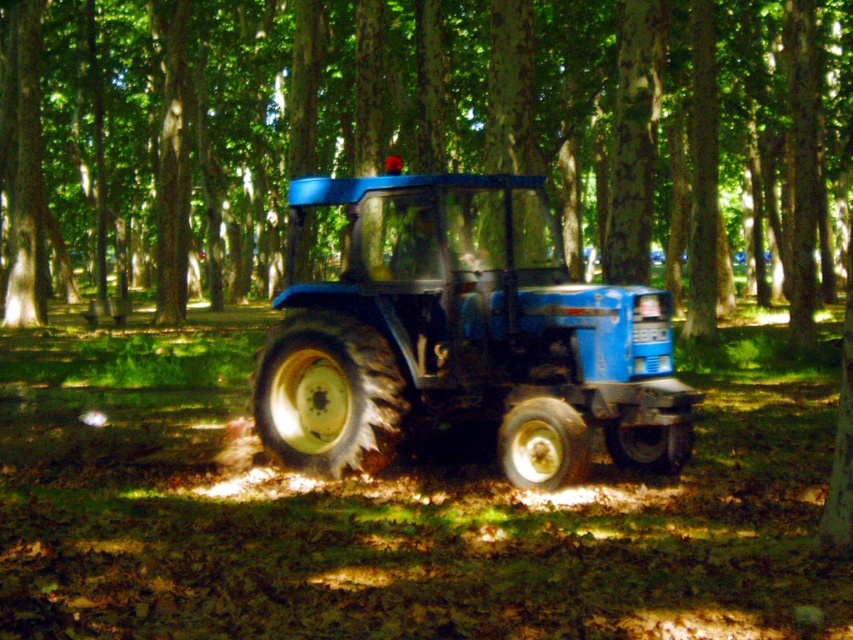
Which is above, matte blue tractor at center or blue matte tractor at center?

matte blue tractor at center is above.

Is matte blue tractor at center below blue matte tractor at center?

No.

Is point (703, 61) farther from camera compared to point (659, 470)?

Yes, it is.

You are a GUI agent. You are given a task and a screenshot of the screen. Output one action in this format:
    pyautogui.click(x=<x>, y=<y>)
    Task: Click on the matte blue tractor at center
    The width and height of the screenshot is (853, 640).
    Given the screenshot: What is the action you would take?
    pyautogui.click(x=425, y=136)